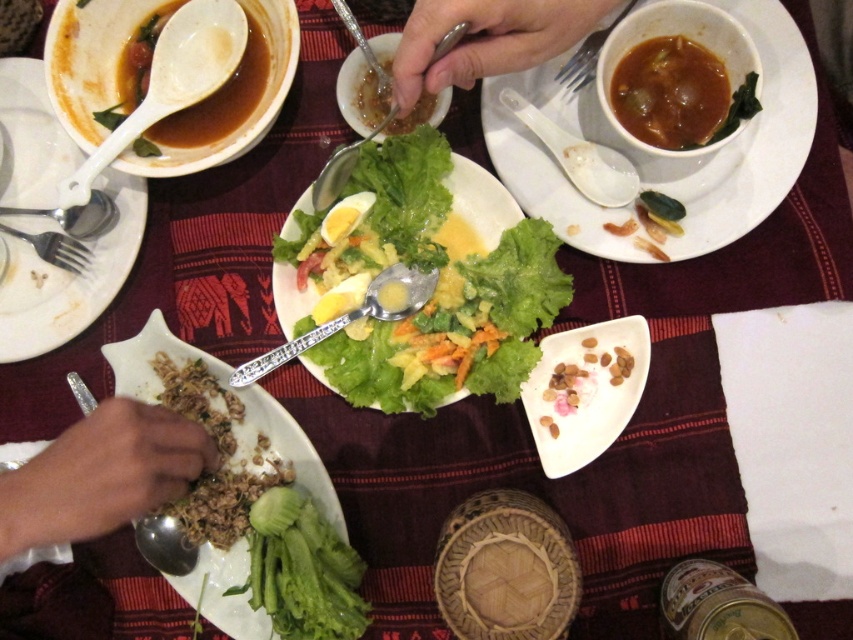
Is point (242, 403) closer to viewer compared to point (540, 406)?

Yes, point (242, 403) is in front of point (540, 406).

Is point (207, 372) positioned in front of point (579, 417)?

Yes, it is in front of point (579, 417).

The height and width of the screenshot is (640, 853). I want to click on brown crumbly rice at lower left, so click(x=225, y=499).

Between point (558, 157) and point (73, 381), which one is positioned in front?

Point (558, 157) is more forward.

Does white plastic spoon at upper center come in front of silver spoon at lower left?

That is False.

Who is more distant from viewer, (x=611, y=154) or (x=77, y=394)?

The point (x=611, y=154) is behind.

The height and width of the screenshot is (640, 853). Find the location of `white plastic spoon at upper center`. white plastic spoon at upper center is located at coordinates (579, 156).

Between brown matte bowl at upper center and white plastic spoon at upper center, which one has less height?

With less height is white plastic spoon at upper center.

Who is more distant from viewer, (811, 112) or (531, 120)?

The point (531, 120) is more distant.

Does point (589, 104) come behind point (601, 182)?

Yes, point (589, 104) is farther from viewer.

Identify the location of brown matte bowl at upper center. Image resolution: width=853 pixels, height=640 pixels. (670, 156).